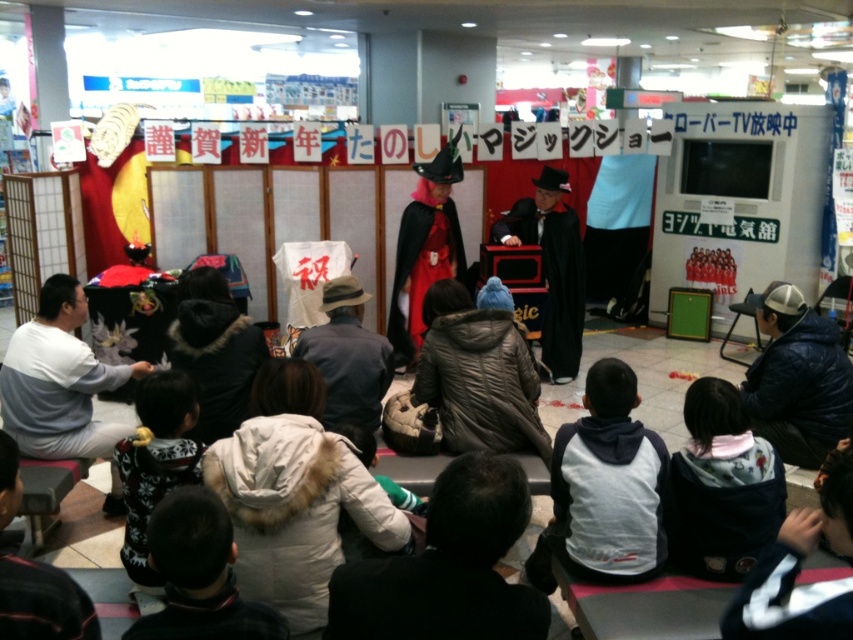
Question: Is white fleece jacket at lower center below matte black magician at center?

Choices:
 (A) yes
 (B) no

Answer: (A)

Question: Which of these objects is positioned closest to the fluffy white sweater at lower left?

Choices:
 (A) white fur-lined jacket at center
 (B) matte black magician at center
 (C) white fleece jacket at lower center
 (D) shiny red cape at center

Answer: (A)

Question: Which point appears closest to the camera in this image?

Choices:
 (A) (158, 376)
 (B) (718, 452)
 (C) (218, 461)
 (D) (640, 541)

Answer: (C)

Question: Can you confirm if white fur-lined jacket at center is thinner than white fleece jacket at lower center?

Choices:
 (A) no
 (B) yes

Answer: (A)

Question: Which point is farther to the camera?

Choices:
 (A) matte black magician at center
 (B) white fur-lined jacket at center

Answer: (A)

Question: Does white fleece jacket at lower center appear under shiny red cape at center?

Choices:
 (A) yes
 (B) no

Answer: (A)